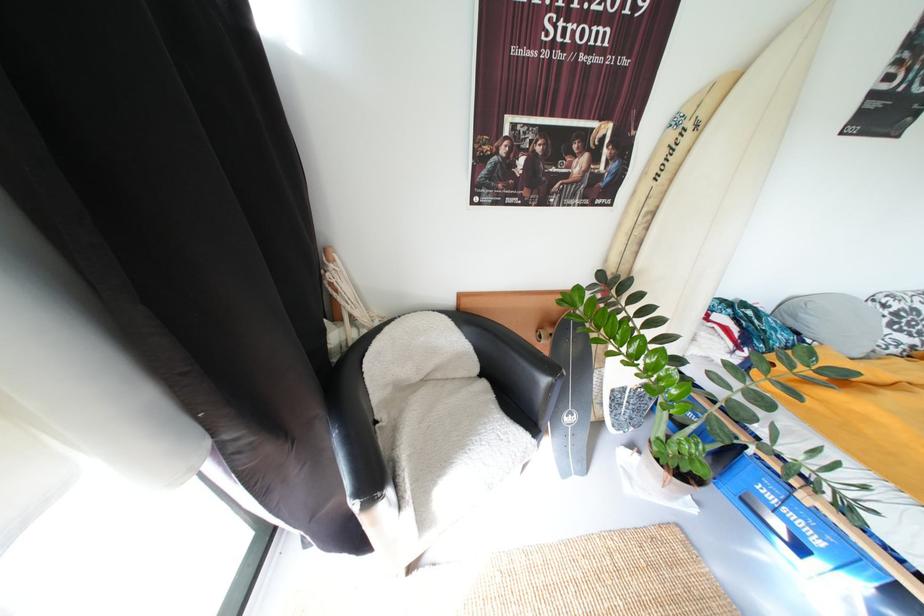
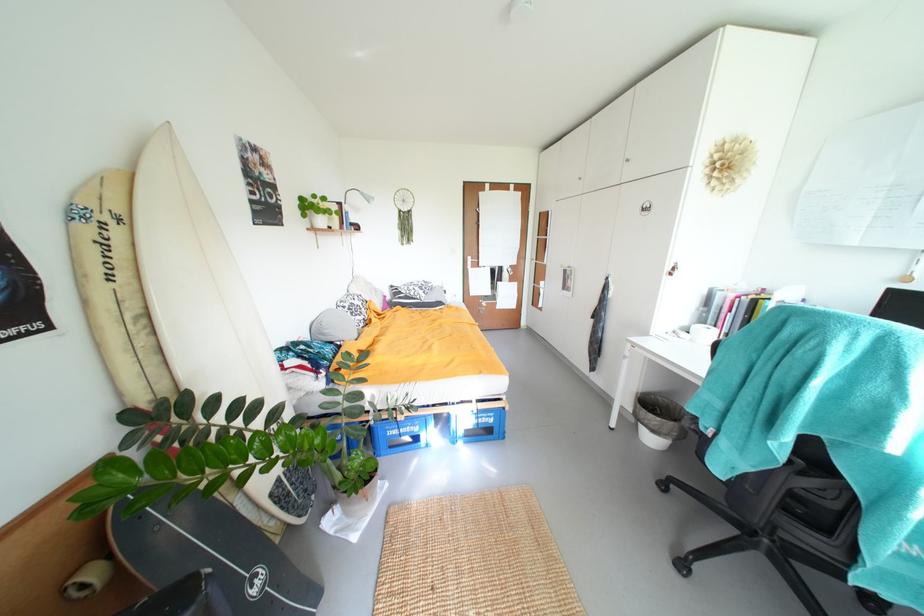
The point at [830,540] is marked in the first image. Where is the corresponding point in the second image?

(423, 428)